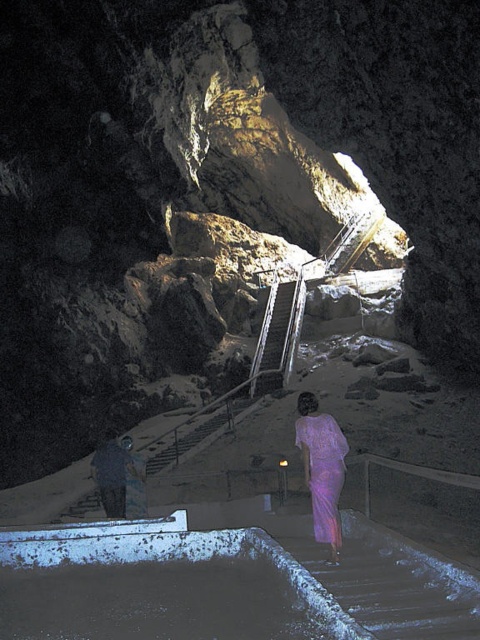
You are standing at the entrance of the cave and see the purple silk dress at center and the dark gray stone statue at lower left. Which object is closer to your right side?

The purple silk dress at center is to the right of the dark gray stone statue at lower left, so the purple silk dress at center is closer to your right side.

You are standing at the entrance of the cave and see the purple silk dress at center and the dark gray stone statue at lower left. Which object is bigger?

The purple silk dress at center is larger in size compared to the dark gray stone statue at lower left.